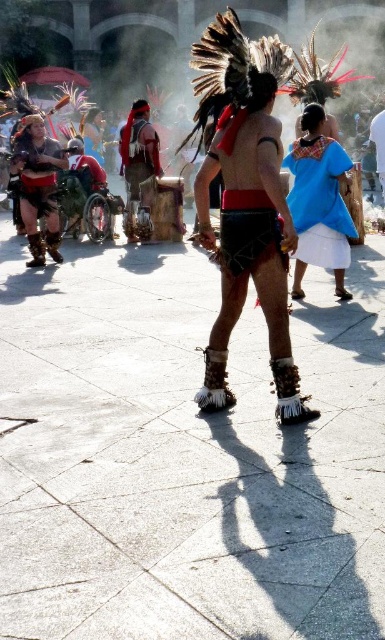
From the picture: You are a photographer standing at the camera position. You want to take a closeup photo of the red feather headdress at center. The camera has a zoom range of 50 feet. Can you capture the headdress in a closeup shot?

The red feather headdress at center and camera are 60.19 feet apart. Since the camera can only zoom up to 50 feet, you cannot capture the headdress in a closeup shot without moving closer.

You are a photographer trying to capture the dancer in the center. You notice the leather moccasins at center and the matte black shorts at left. Which of these items would appear larger in your photo?

The leather moccasins at center would appear larger in the photo because they are bigger than the matte black shorts at left.

From the picture: You are a photographer trying to capture a photo of the central dancer. You notice the blue cotton shirt at upper right and the matte black shorts at left in your frame. Which object is closer to the bottom edge of your camera view?

The blue cotton shirt at upper right is positioned under matte black shorts at left, so the blue cotton shirt at upper right is closer to the bottom edge of the camera view.